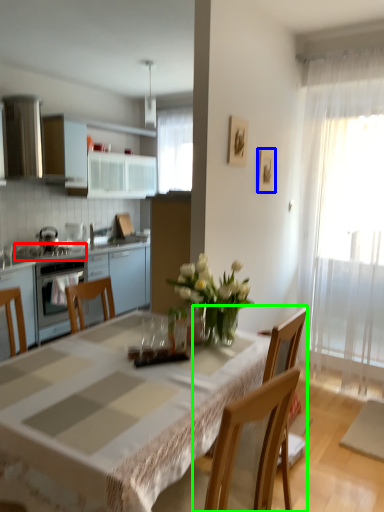
Question: Based on their relative distances, which object is farther from gas stove (highlighted by a red box)? Choose from picture frame (highlighted by a blue box) and chair (highlighted by a green box).

Choices:
 (A) picture frame
 (B) chair

Answer: (B)